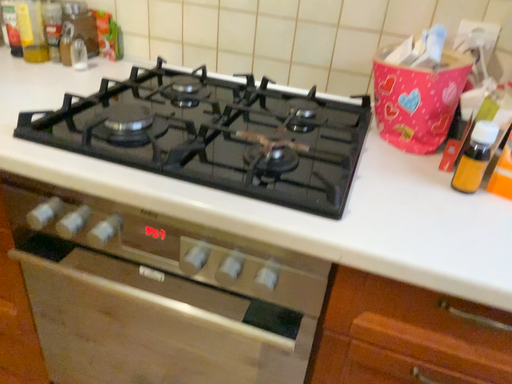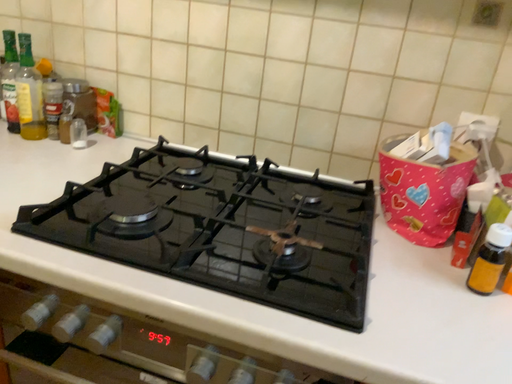
Question: How did the camera likely rotate when shooting the video?

Choices:
 (A) rotated upward
 (B) rotated downward

Answer: (A)